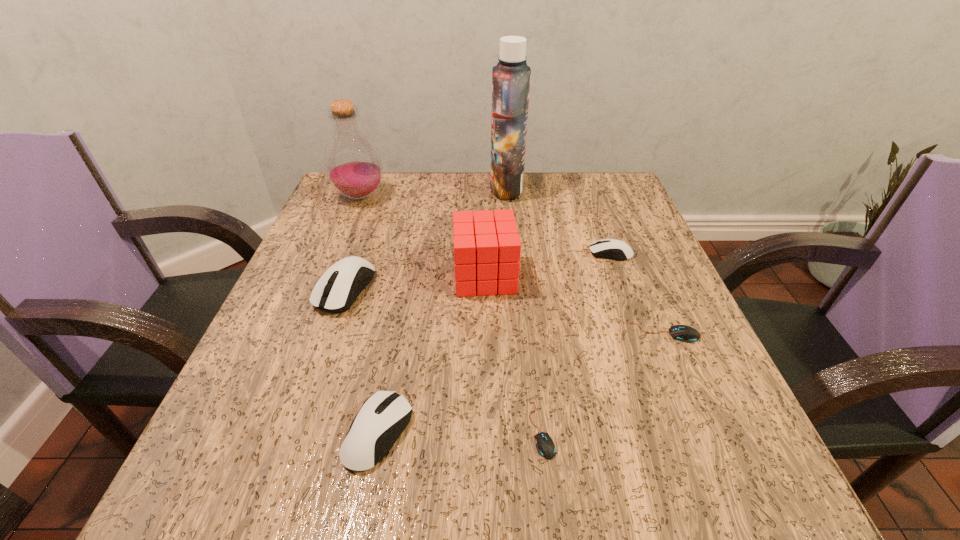
Find the location of a particular element. The height and width of the screenshot is (540, 960). shampoo is located at coordinates (511, 76).

Locate an element on the screen. The width and height of the screenshot is (960, 540). the tallest object is located at coordinates (511, 76).

At what (x,y) coordinates should I click in order to perform the action: click on purple bottle. Please return your answer as a coordinate pair (x, y). Looking at the image, I should click on (352, 162).

Where is `bottle`? This screenshot has height=540, width=960. bottle is located at coordinates (352, 162).

Where is `the third tallest object`? the third tallest object is located at coordinates (487, 248).

Locate an element on the screen. red cube is located at coordinates (487, 248).

Find the location of a particular element. The width and height of the screenshot is (960, 540). the fourth tallest object is located at coordinates (333, 292).

Locate an element on the screen. The height and width of the screenshot is (540, 960). the leftmost mouse is located at coordinates (333, 292).

This screenshot has width=960, height=540. In order to click on the second mouse from left to right in this screenshot , I will do `click(383, 417)`.

In order to click on the fourth shortest object in this screenshot , I will do `click(383, 417)`.